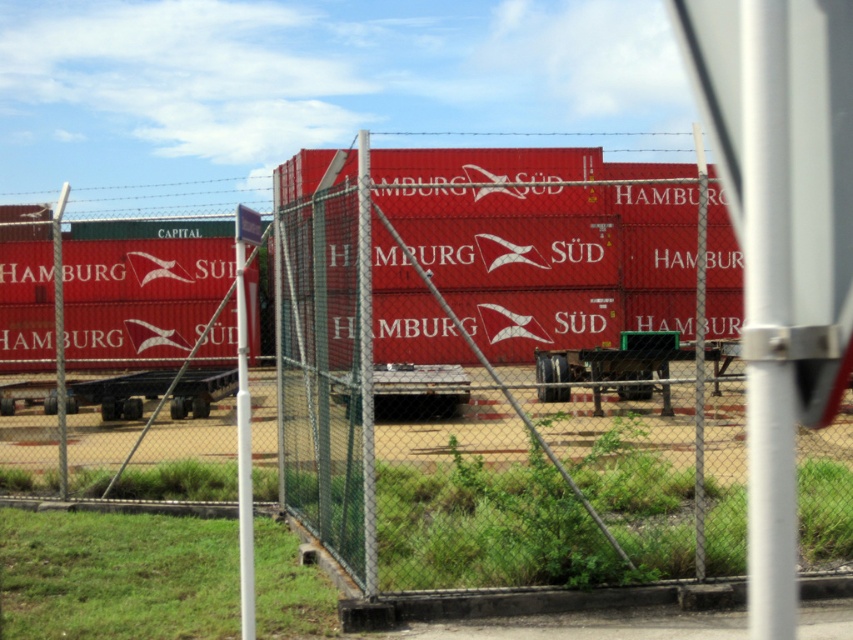
Question: Can you confirm if metal mesh fence at center is positioned to the right of metallic trailer truck at center?

Choices:
 (A) no
 (B) yes

Answer: (B)

Question: Can you confirm if metal mesh fence at center is smaller than green metallic trailer truck at center?

Choices:
 (A) no
 (B) yes

Answer: (A)

Question: Which point is closer to the camera taking this photo?

Choices:
 (A) (605, 461)
 (B) (622, 360)
 (C) (460, 380)

Answer: (A)

Question: Can you confirm if metal mesh fence at center is smaller than metallic trailer truck at center?

Choices:
 (A) yes
 (B) no

Answer: (B)

Question: Which object is farther from the camera taking this photo?

Choices:
 (A) green metallic trailer truck at center
 (B) metal mesh fence at center

Answer: (A)

Question: Which point is closer to the camera taking this photo?

Choices:
 (A) (393, 380)
 (B) (549, 355)

Answer: (A)